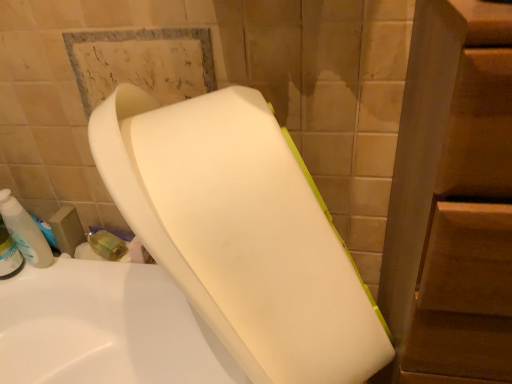
Question: Would you say translucent plastic soap dispenser at left is to the left or to the right of white matte toilet at center in the picture?

Choices:
 (A) right
 (B) left

Answer: (B)

Question: Is translucent plastic soap dispenser at left in front of or behind white matte toilet at center in the image?

Choices:
 (A) front
 (B) behind

Answer: (B)

Question: From the image's perspective, is translucent plastic soap dispenser at left above or below white matte toilet at center?

Choices:
 (A) above
 (B) below

Answer: (A)

Question: In terms of size, does white matte toilet at center appear bigger or smaller than translucent plastic soap dispenser at left?

Choices:
 (A) big
 (B) small

Answer: (A)

Question: From the image's perspective, is white matte toilet at center above or below translucent plastic soap dispenser at left?

Choices:
 (A) below
 (B) above

Answer: (A)

Question: In terms of height, does white matte toilet at center look taller or shorter compared to translucent plastic soap dispenser at left?

Choices:
 (A) short
 (B) tall

Answer: (B)

Question: Is point (187, 223) closer or farther from the camera than point (26, 223)?

Choices:
 (A) closer
 (B) farther

Answer: (A)